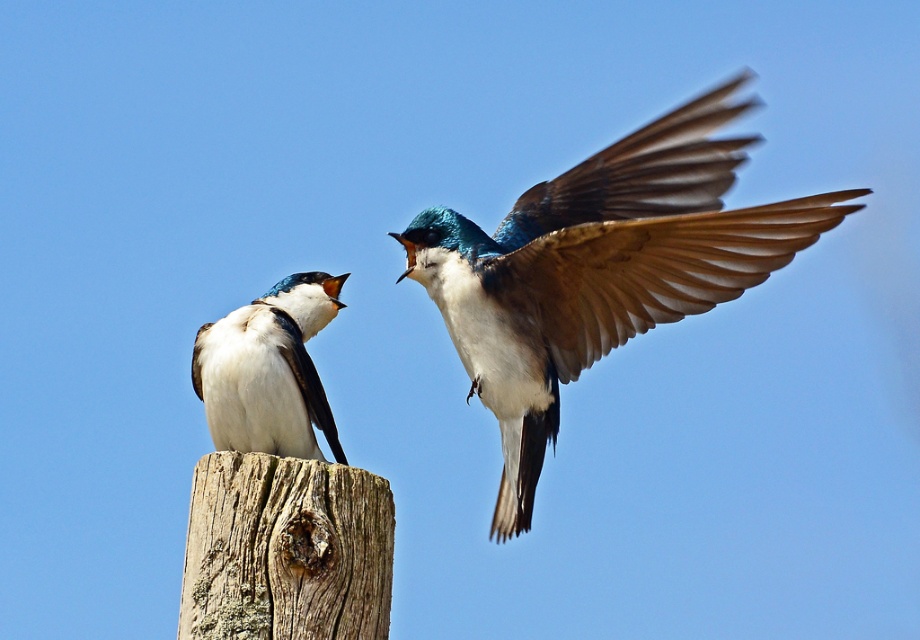
This screenshot has width=920, height=640. Identify the location of shiny blue and white bird at center. (599, 269).

Can you confirm if shiny blue and white bird at center is shorter than white matte bird at left?

No.

Who is more forward, (493, 524) or (305, 419)?

Point (305, 419)

I want to click on shiny blue and white bird at center, so click(599, 269).